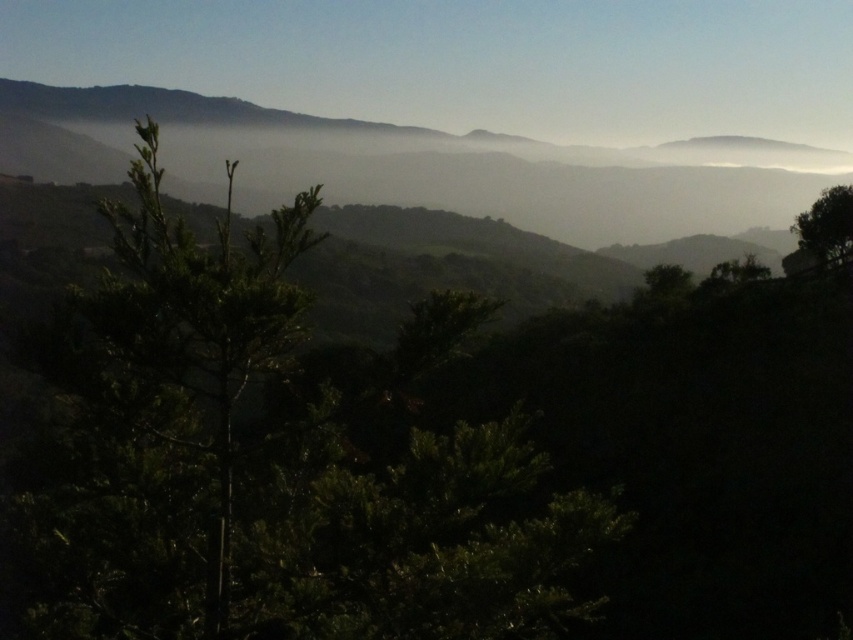
Question: Estimate the real-world distances between objects in this image. Which object is closer to the silvery misty mountain at upper center?

Choices:
 (A) green matte tree at center
 (B) green leafy tree at right

Answer: (A)

Question: Which object is closer to the camera taking this photo?

Choices:
 (A) silvery misty mountain at upper center
 (B) green matte tree at center

Answer: (B)

Question: Can you confirm if green matte tree at center is smaller than green leafy tree at right?

Choices:
 (A) no
 (B) yes

Answer: (A)

Question: Does green matte tree at center have a lesser width compared to silvery misty mountain at upper center?

Choices:
 (A) yes
 (B) no

Answer: (A)

Question: Based on their relative distances, which object is farther from the silvery misty mountain at upper center?

Choices:
 (A) green leafy tree at right
 (B) green matte tree at center

Answer: (A)

Question: From the image, what is the correct spatial relationship of green matte tree at center in relation to green leafy tree at right?

Choices:
 (A) right
 (B) left

Answer: (B)